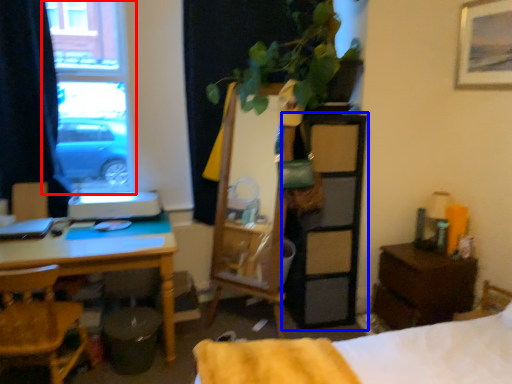
Question: Which object appears closest to the camera in this image, window (highlighted by a red box) or dresser (highlighted by a blue box)?

Choices:
 (A) window
 (B) dresser

Answer: (A)